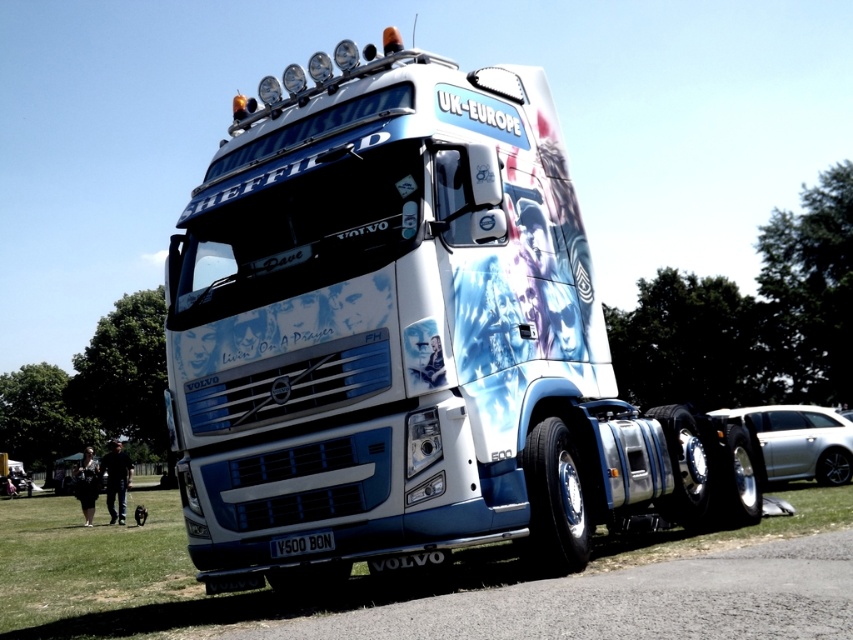
Who is more distant from viewer, (194, 310) or (792, 486)?

Positioned behind is point (792, 486).

Does point (343, 483) come farther from viewer compared to point (122, 536)?

No.

In order to click on white glossy truck at center in this screenshot , I will do (410, 339).

How distant is white glossy truck at center from black metallic license plate at bottom?

A distance of 5.00 feet exists between white glossy truck at center and black metallic license plate at bottom.

Which is more to the right, white glossy truck at center or black metallic license plate at bottom?

Positioned to the right is white glossy truck at center.

Who is more distant from viewer, (372,515) or (315,541)?

The point (315,541) is more distant.

This screenshot has width=853, height=640. Find the location of `white glossy truck at center`. white glossy truck at center is located at coordinates 410,339.

This screenshot has width=853, height=640. In order to click on silver metallic car at lower right in this screenshot , I will do `click(799, 442)`.

Between point (795, 433) and point (305, 552), which one is positioned behind?

The point (795, 433) is more distant.

You are a GUI agent. You are given a task and a screenshot of the screen. Output one action in this format:
    pyautogui.click(x=<x>, y=<y>)
    Task: Click on the silver metallic car at lower right
    
    Given the screenshot: What is the action you would take?
    [x=799, y=442]